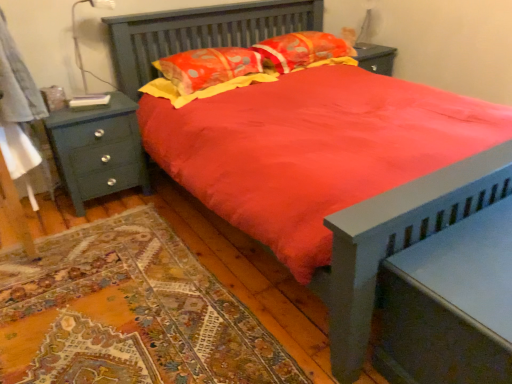
Question: Do you think metallic gray table lamp at upper left is within floral fabric pillow at upper center, which is the 1th pillow in right-to-left order, or outside of it?

Choices:
 (A) outside
 (B) inside

Answer: (A)

Question: From a real-world perspective, relative to floral fabric pillow at upper center, which is the second pillow from left to right, is metallic gray table lamp at upper left vertically above or below?

Choices:
 (A) above
 (B) below

Answer: (A)

Question: Which of these objects is positioned closest to the quilted orange pillow at center, positioned as the first pillow in left-to-right order?

Choices:
 (A) teal wood nightstand at left, arranged as the 2th nightstand when viewed from the right
 (B) floral fabric pillow at upper center, which is the 1th pillow in right-to-left order
 (C) matte gray nightstand at lower right, marked as the first nightstand in a front-to-back arrangement
 (D) metallic gray table lamp at upper left

Answer: (B)

Question: Estimate the real-world distances between objects in this image. Which object is closer to the floral fabric pillow at upper center, which is the 1th pillow in right-to-left order?

Choices:
 (A) metallic gray table lamp at upper left
 (B) quilted orange pillow at center, which ranks as the 2th pillow in right-to-left order
 (C) teal wood nightstand at left, the 2th nightstand in the bottom-to-top sequence
 (D) matte gray nightstand at lower right, which appears as the 1th nightstand when viewed from the right

Answer: (B)